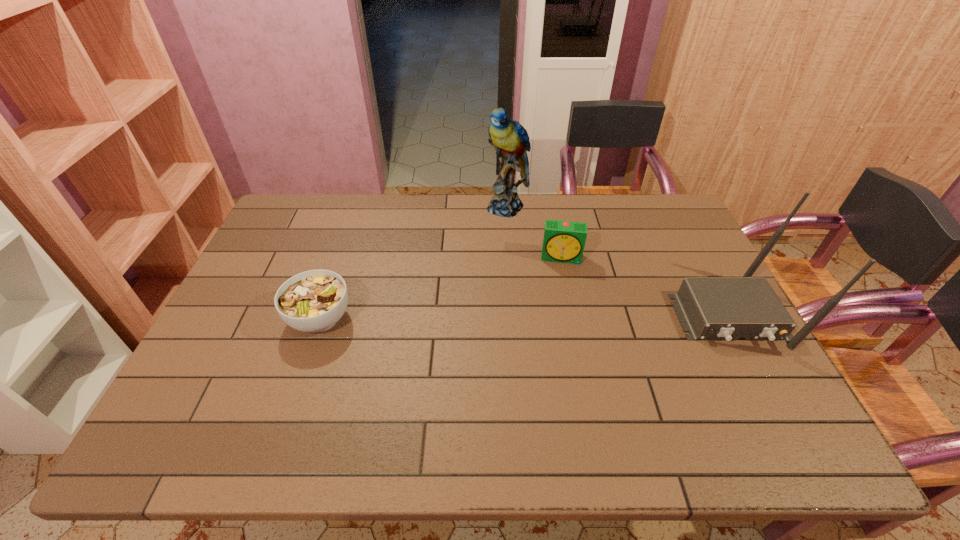
The height and width of the screenshot is (540, 960). I want to click on free space between the third tallest object and the second tallest object, so click(645, 287).

Locate an element on the screen. free point between the second tallest object and the second shortest object is located at coordinates (645, 287).

You are a GUI agent. You are given a task and a screenshot of the screen. Output one action in this format:
    pyautogui.click(x=<x>, y=<y>)
    Task: Click on the vacant point located between the third object from left to right and the third object from right to left
    The height and width of the screenshot is (540, 960).
    Given the screenshot: What is the action you would take?
    pyautogui.click(x=535, y=232)

Find the location of `object that is the second closest to the alarm clock`. object that is the second closest to the alarm clock is located at coordinates (710, 308).

Identify which object is the second closest to the router. Please provide its 2D coordinates. Your answer should be formatted as a tuple, i.e. [(x, y)], where the tuple contains the x and y coordinates of a point satisfying the conditions above.

[(510, 139)]

Image resolution: width=960 pixels, height=540 pixels. Identify the location of vacant region that satisfies the following two spatial constraints: 1. on the front side of the third nearest object; 2. on the left side of the second object from left to right. (512, 258).